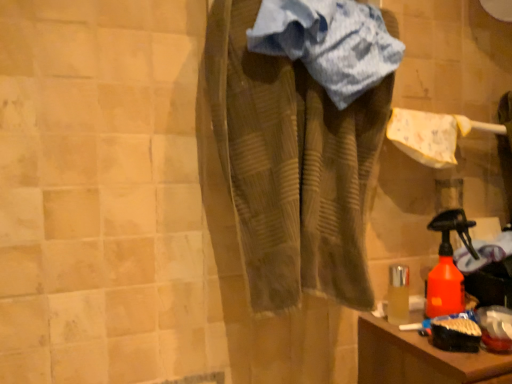
This screenshot has width=512, height=384. I want to click on orange matte spray bottle at lower right, so click(x=448, y=266).

Where is `towel in front of the orange matte spray bottle at lower right`? towel in front of the orange matte spray bottle at lower right is located at coordinates (329, 43).

In the scene shown: Is blue striped towel at center looking in the opposite direction of orange matte spray bottle at lower right?

blue striped towel at center is not turned away from orange matte spray bottle at lower right.

Does blue striped towel at center have a larger size compared to orange matte spray bottle at lower right?

Yes, blue striped towel at center is bigger than orange matte spray bottle at lower right.

Looking at this image, in terms of width, does orange matte spray bottle at lower right look wider or thinner when compared to brown textured towel at center?

Clearly, orange matte spray bottle at lower right has less width compared to brown textured towel at center.

Measure the distance between orange matte spray bottle at lower right and brown textured towel at center.

orange matte spray bottle at lower right and brown textured towel at center are 16.38 inches apart.

Between orange matte spray bottle at lower right and brown textured towel at center, which one has less height?

orange matte spray bottle at lower right is shorter.

From the image's perspective, is orange matte spray bottle at lower right under brown textured towel at center?

Yes, from the image's perspective, orange matte spray bottle at lower right is below brown textured towel at center.

Is orange matte spray bottle at lower right beside blue striped towel at center?

No.

Is orange matte spray bottle at lower right oriented towards blue striped towel at center?

No, orange matte spray bottle at lower right is not aimed at blue striped towel at center.

From the image's perspective, who appears lower, orange matte spray bottle at lower right or blue striped towel at center?

orange matte spray bottle at lower right.

The height and width of the screenshot is (384, 512). I want to click on bottle below the blue striped towel at center (from the image's perspective), so click(x=448, y=266).

From a real-world perspective, does brown textured towel at center stand above orange matte spray bottle at lower right?

Yes, from a real-world perspective, brown textured towel at center is over orange matte spray bottle at lower right

Locate an element on the screen. clothing that is on the left side of orange matte spray bottle at lower right is located at coordinates pos(291,166).

From the picture: Is brown textured towel at center oriented towards orange matte spray bottle at lower right?

No, brown textured towel at center is not aimed at orange matte spray bottle at lower right.

Looking at this image, is brown textured towel at center taller or shorter than orange matte spray bottle at lower right?

Considering their sizes, brown textured towel at center has more height than orange matte spray bottle at lower right.

From the image's perspective, which object appears higher, blue striped towel at center or brown textured towel at center?

From the image's view, blue striped towel at center is above.

Is brown textured towel at center a part of blue striped towel at center?

No, brown textured towel at center is not surrounded by blue striped towel at center.

Image resolution: width=512 pixels, height=384 pixels. In the image, there is a blue striped towel at center. In order to click on clothing below it (from the image's perspective) in this screenshot , I will do `click(291, 166)`.

Does blue striped towel at center turn towards brown textured towel at center?

Yes, blue striped towel at center is facing brown textured towel at center.

Is brown textured towel at center facing towards blue striped towel at center?

Yes, brown textured towel at center is turned towards blue striped towel at center.

Which is closer, (x=311, y=201) or (x=372, y=60)?

Clearly, point (x=311, y=201) is closer to the camera than point (x=372, y=60).

Looking at this image, is brown textured towel at center closer to the viewer compared to blue striped towel at center?

Yes.

From the image's perspective, is brown textured towel at center on top of blue striped towel at center?

No, from the image's perspective, brown textured towel at center is not on top of blue striped towel at center.

Image resolution: width=512 pixels, height=384 pixels. I want to click on bottle behind the blue striped towel at center, so click(448, 266).

You are a GUI agent. You are given a task and a screenshot of the screen. Output one action in this format:
    pyautogui.click(x=<x>, y=<y>)
    Task: Click on the bottle located on the right of brown textured towel at center
    The width and height of the screenshot is (512, 384).
    Given the screenshot: What is the action you would take?
    pyautogui.click(x=448, y=266)

When comparing their distances from blue striped towel at center, does brown textured towel at center or orange matte spray bottle at lower right seem further?

orange matte spray bottle at lower right is positioned further to the anchor blue striped towel at center.

Based on their spatial positions, is orange matte spray bottle at lower right or brown textured towel at center closer to blue striped towel at center?

brown textured towel at center.

Which object lies further to the anchor point brown textured towel at center, blue striped towel at center or orange matte spray bottle at lower right?

orange matte spray bottle at lower right lies further to brown textured towel at center than the other object.

Based on their spatial positions, is orange matte spray bottle at lower right or blue striped towel at center closer to brown textured towel at center?

blue striped towel at center.

Based on their spatial positions, is blue striped towel at center or brown textured towel at center further from orange matte spray bottle at lower right?

blue striped towel at center.

Considering their positions, is brown textured towel at center positioned closer to orange matte spray bottle at lower right than blue striped towel at center?

brown textured towel at center.

Where is `clothing between blue striped towel at center and orange matte spray bottle at lower right vertically`? Image resolution: width=512 pixels, height=384 pixels. clothing between blue striped towel at center and orange matte spray bottle at lower right vertically is located at coordinates (291, 166).